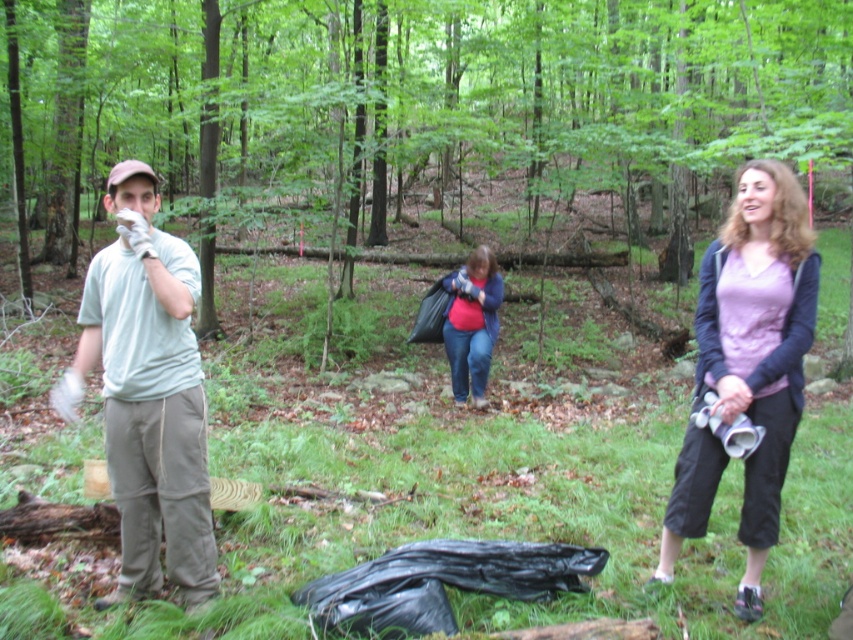
Measure the distance between white cotton glove at left and matte purple shirt at center.

The distance of white cotton glove at left from matte purple shirt at center is 7.61 feet.

Does point (161, 531) come closer to viewer compared to point (758, 186)?

No, it is not.

Between point (108, 204) and point (795, 384), which one is positioned in front?

Point (108, 204)

This screenshot has width=853, height=640. Identify the location of white cotton glove at left. (148, 394).

Can you confirm if green matte forest at center is positioned to the right of white cotton glove at left?

Indeed, green matte forest at center is positioned on the right side of white cotton glove at left.

Does green matte forest at center have a lesser width compared to white cotton glove at left?

Incorrect, green matte forest at center's width is not less than white cotton glove at left's.

Who is more forward, [769,100] or [80,348]?

Point [80,348]

This screenshot has width=853, height=640. Identify the location of green matte forest at center. click(x=428, y=97).

Is green matte forest at center above matte pink shirt at center?

Yes.

Looking at this image, who is lower down, green matte forest at center or matte pink shirt at center?

matte pink shirt at center

This screenshot has height=640, width=853. What do you see at coordinates (428, 97) in the screenshot?
I see `green matte forest at center` at bounding box center [428, 97].

Identify the location of green matte forest at center. This screenshot has width=853, height=640. (428, 97).